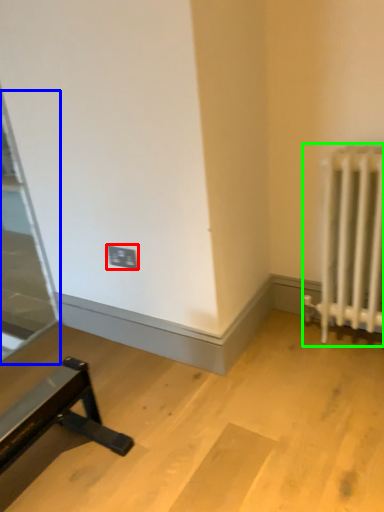
Question: Considering the real-world distances, which object is closest to electric outlet (highlighted by a red box)? glass door (highlighted by a blue box) or radiator (highlighted by a green box).

Choices:
 (A) glass door
 (B) radiator

Answer: (B)